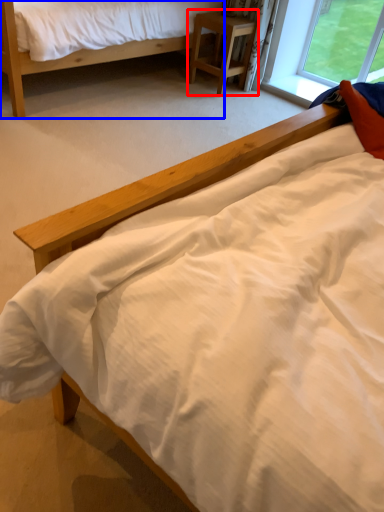
Question: Which point is further to the camera, nightstand (highlighted by a red box) or bed (highlighted by a blue box)?

Choices:
 (A) nightstand
 (B) bed

Answer: (A)